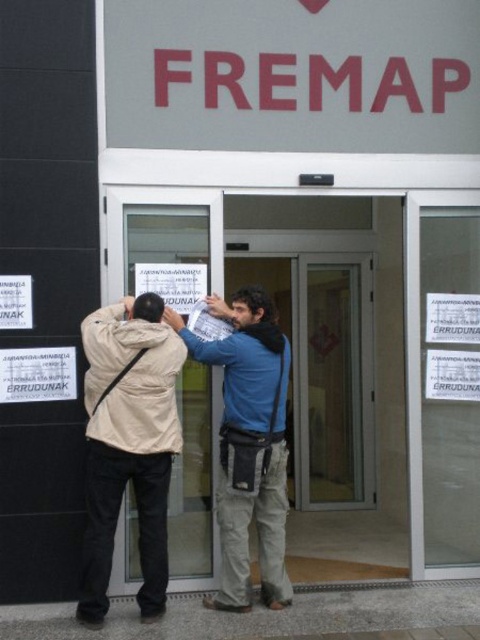
Question: Which of the following is the closest to the observer?

Choices:
 (A) (97, 556)
 (B) (162, 106)

Answer: (A)

Question: Which of the following is the farthest from the observer?

Choices:
 (A) red plastic sign at upper center
 (B) beige fabric jacket at left

Answer: (A)

Question: Can you confirm if red plastic sign at upper center is wider than beige fabric jacket at center?

Choices:
 (A) yes
 (B) no

Answer: (A)

Question: Is red plastic sign at upper center to the left of beige fabric jacket at left from the viewer's perspective?

Choices:
 (A) yes
 (B) no

Answer: (B)

Question: Based on their relative distances, which object is nearer to the red plastic sign at upper center?

Choices:
 (A) beige fabric jacket at center
 (B) beige fabric jacket at left

Answer: (A)

Question: Does beige fabric jacket at center appear under beige fabric jacket at left?

Choices:
 (A) yes
 (B) no

Answer: (A)